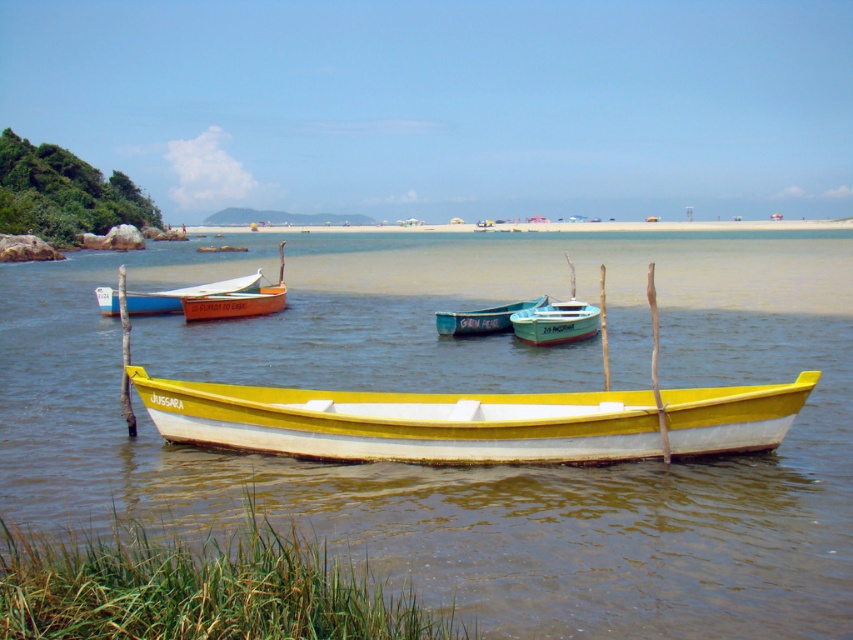
Describe the element at coordinates (473, 420) in the screenshot. I see `yellow matte boat at center` at that location.

Can you confirm if yellow matte boat at center is bigger than teal glossy canoe at center?

No, yellow matte boat at center is not bigger than teal glossy canoe at center.

Which is in front, point (706, 392) or point (444, 317)?

Point (706, 392)

Locate an element on the screen. The image size is (853, 640). yellow matte boat at center is located at coordinates (473, 420).

Between teal matte boat at center and orange wood canoe at center, which one is positioned lower?

Positioned lower is teal matte boat at center.

The width and height of the screenshot is (853, 640). Describe the element at coordinates (556, 323) in the screenshot. I see `teal matte boat at center` at that location.

Locate an element on the screen. The image size is (853, 640). teal matte boat at center is located at coordinates (556, 323).

Locate an element on the screen. teal matte boat at center is located at coordinates (556, 323).

Can you confirm if yellow matte water at center is positioned above matte white canoe at center?

Indeed, yellow matte water at center is positioned over matte white canoe at center.

Who is more forward, (381, 262) or (154, 296)?

Point (154, 296) is in front.

This screenshot has height=640, width=853. Find the location of `yellow matte water at center`. yellow matte water at center is located at coordinates (469, 392).